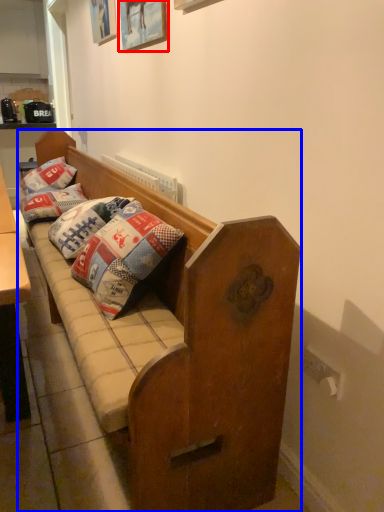
Question: Among these objects, which one is nearest to the camera, picture frame (highlighted by a red box) or studio couch (highlighted by a blue box)?

Choices:
 (A) picture frame
 (B) studio couch

Answer: (B)